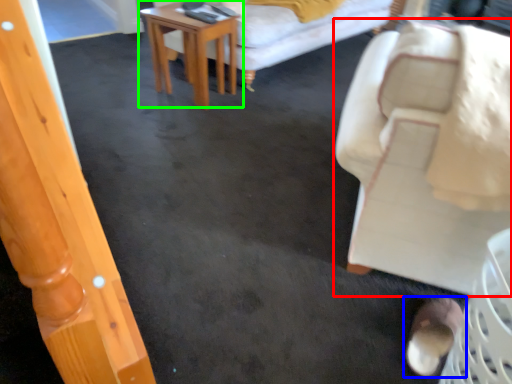
Question: Estimate the real-world distances between objects in this image. Which object is farther from chair (highlighted by a red box), footwear (highlighted by a blue box) or table (highlighted by a green box)?

Choices:
 (A) footwear
 (B) table

Answer: (B)